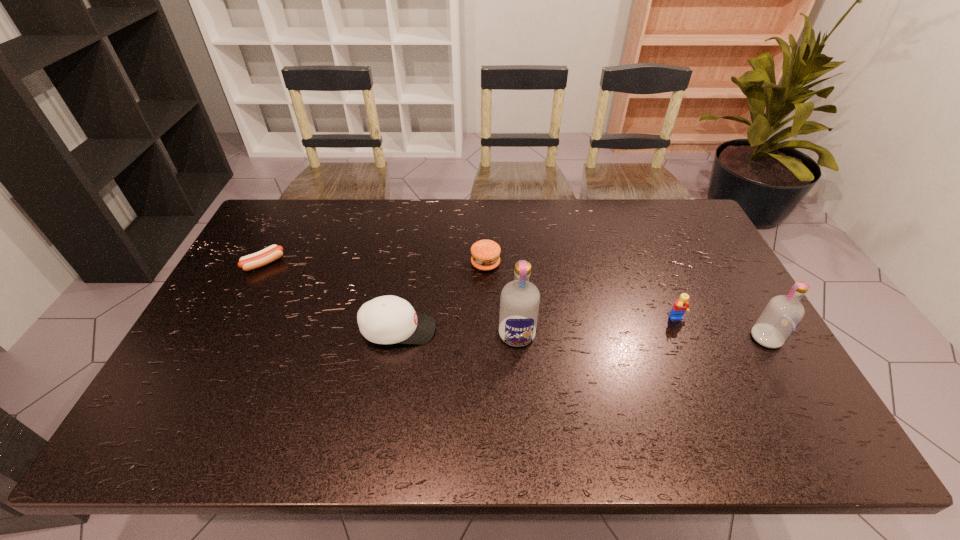
Find the location of a particular element. Image resolution: width=960 pixels, height=540 pixels. the tallest object is located at coordinates (519, 302).

Find the location of a particular element. This screenshot has height=540, width=960. the taller vodka is located at coordinates (519, 302).

This screenshot has width=960, height=540. Find the location of `the rightmost object`. the rightmost object is located at coordinates 783,314.

At what (x,y) coordinates should I click in order to perform the action: click on the fifth shortest object. Please return your answer as a coordinate pair (x, y). Looking at the image, I should click on (783, 314).

This screenshot has width=960, height=540. Find the location of `the shortest object`. the shortest object is located at coordinates (273, 252).

Where is `the leftmost object`? the leftmost object is located at coordinates (273, 252).

What are the coordinates of `the fifth tallest object` in the screenshot? It's located at (485, 253).

The image size is (960, 540). What are the coordinates of `the second object from left to right` in the screenshot? It's located at tap(389, 319).

This screenshot has width=960, height=540. Identify the location of the fifth object from left to right. (681, 305).

Locate an element on the screen. free space located on the label of the tallest object is located at coordinates (522, 401).